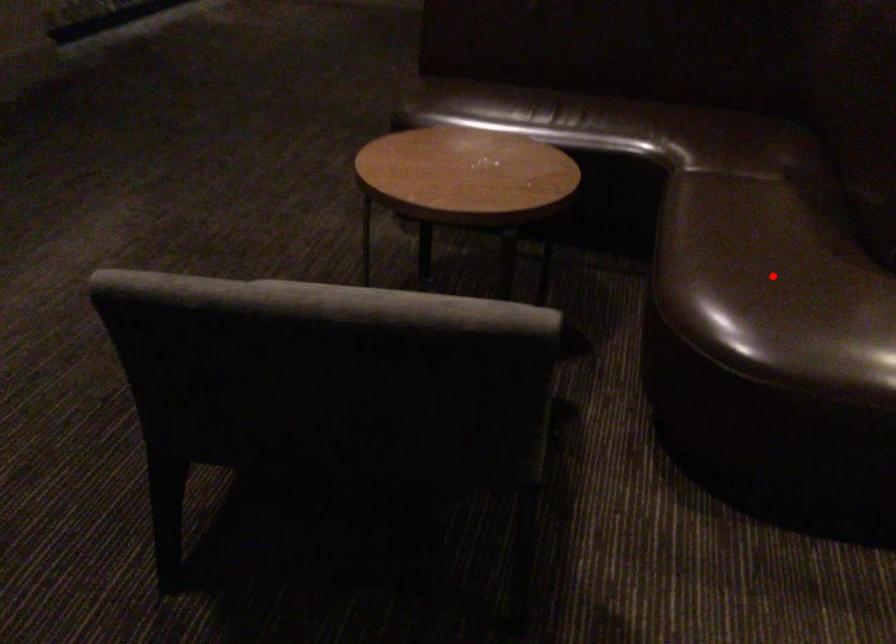
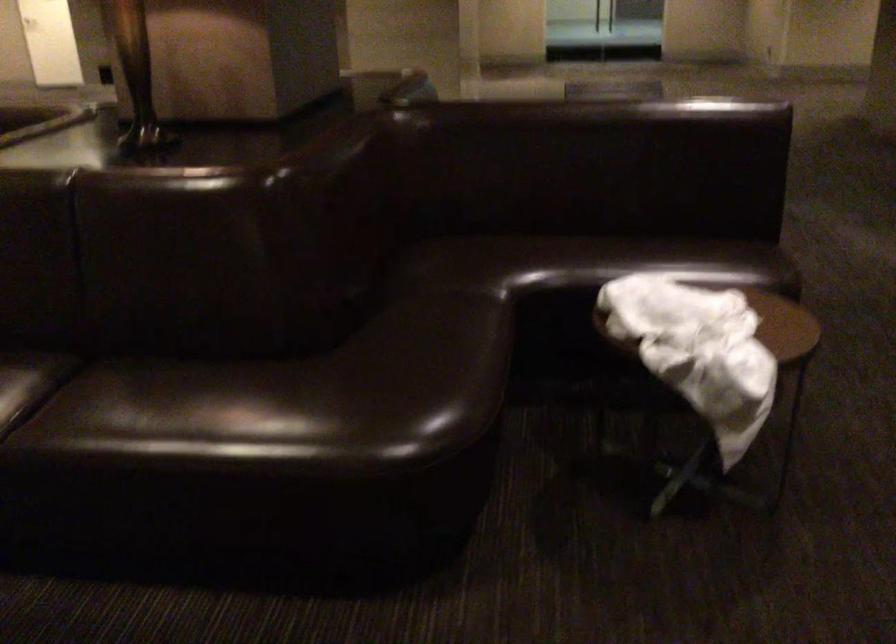
Question: I am providing you with two images of the same scene from different viewpoints. A red point is marked on the first image. Can you still see the location of the red point in image 2?

Choices:
 (A) Yes
 (B) No

Answer: (B)